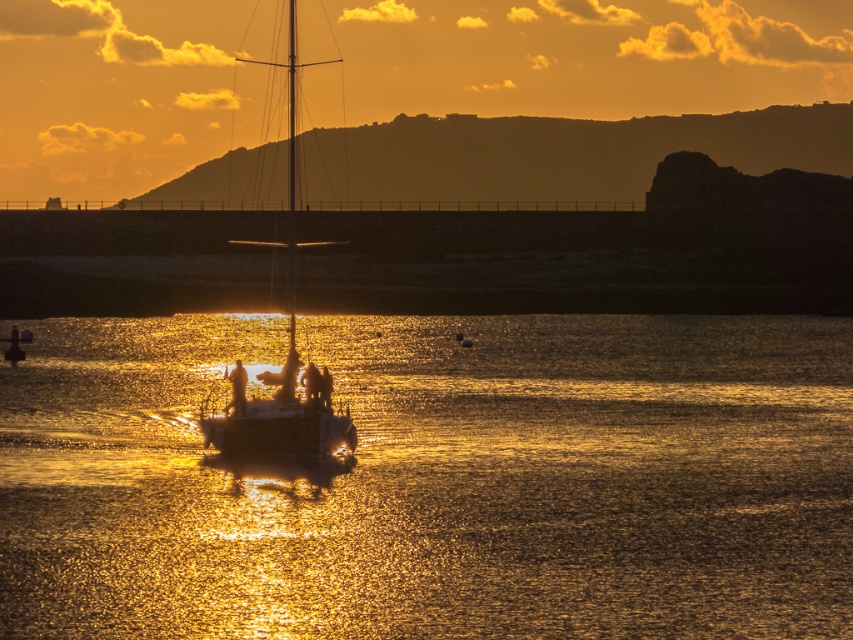
Does glistening water at center appear on the right side of silhouette figure at center?

Correct, you'll find glistening water at center to the right of silhouette figure at center.

Which is in front, point (476, 502) or point (238, 394)?

Point (476, 502) is more forward.

Which is in front, point (635, 440) or point (244, 412)?

Point (244, 412) is more forward.

Where is `glistening water at center`? This screenshot has width=853, height=640. glistening water at center is located at coordinates (437, 481).

Who is positioned more to the right, smooth skin person at center or silhouette human at center?

silhouette human at center

The height and width of the screenshot is (640, 853). Find the location of `smooth skin person at center`. smooth skin person at center is located at coordinates [311, 381].

Who is more distant from viewer, (317, 387) or (328, 397)?

Positioned behind is point (328, 397).

Locate an element on the screen. smooth skin person at center is located at coordinates (311, 381).

Does point (38, 529) lie behind point (289, 72)?

That is False.

What are the coordinates of `glistening water at center` in the screenshot? It's located at (437, 481).